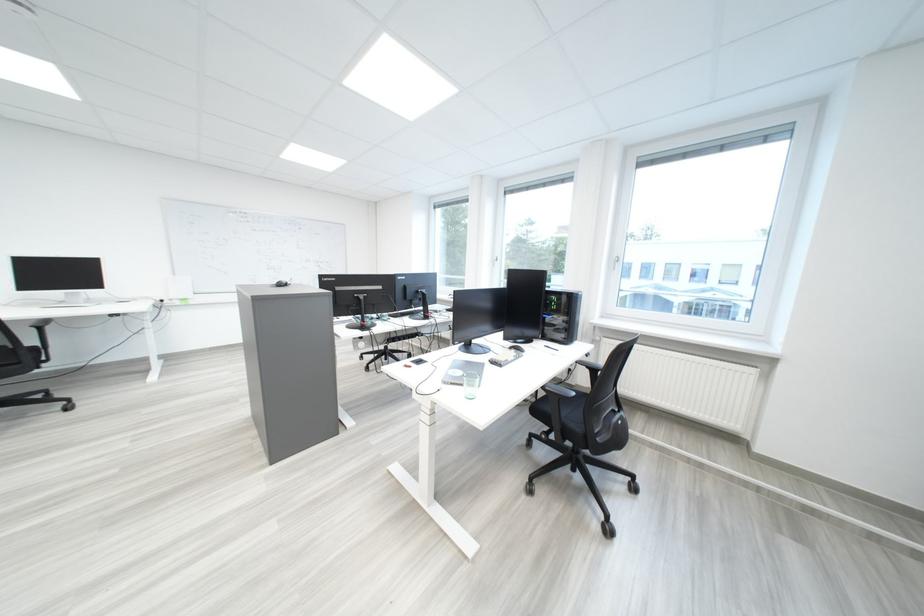
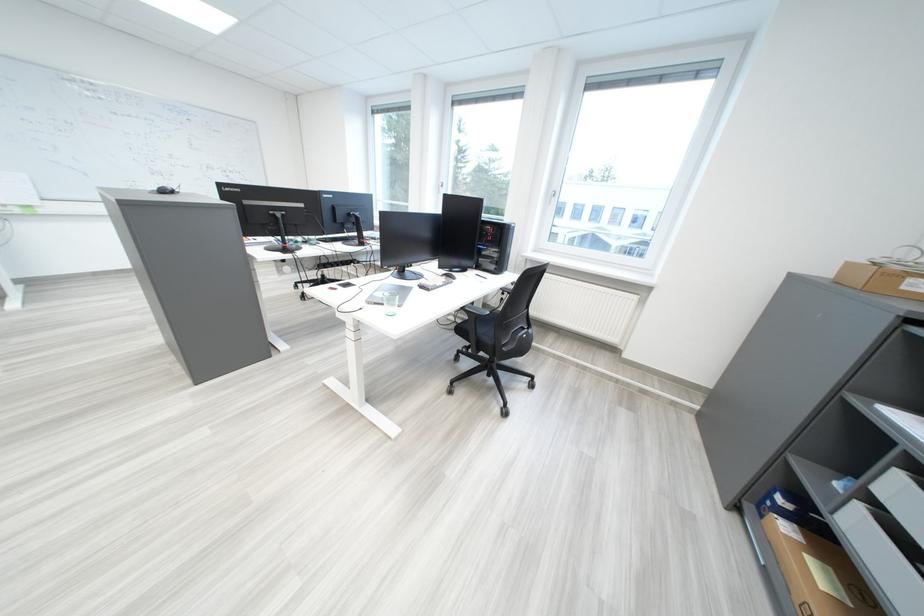
The point at [505,363] is marked in the first image. Where is the corresponding point in the second image?

(434, 289)